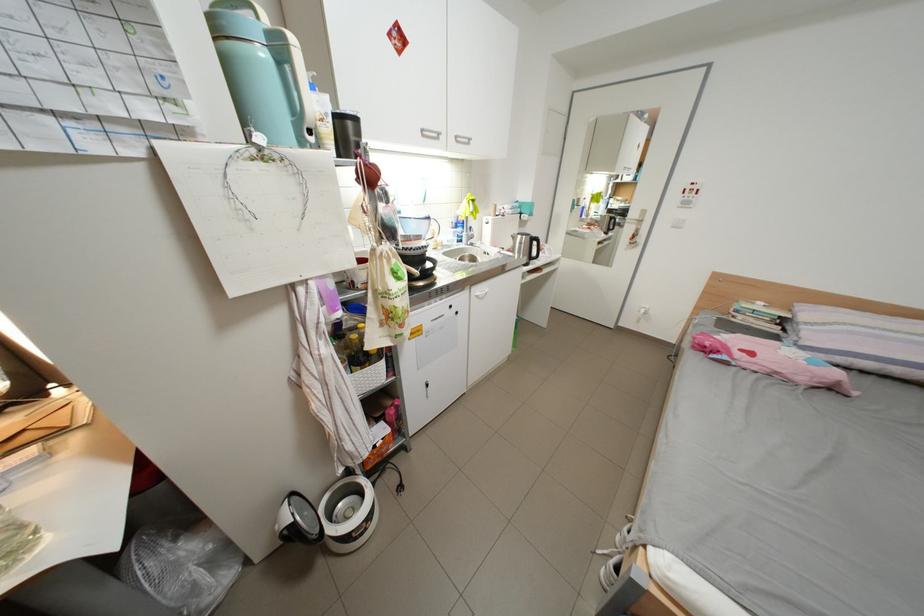
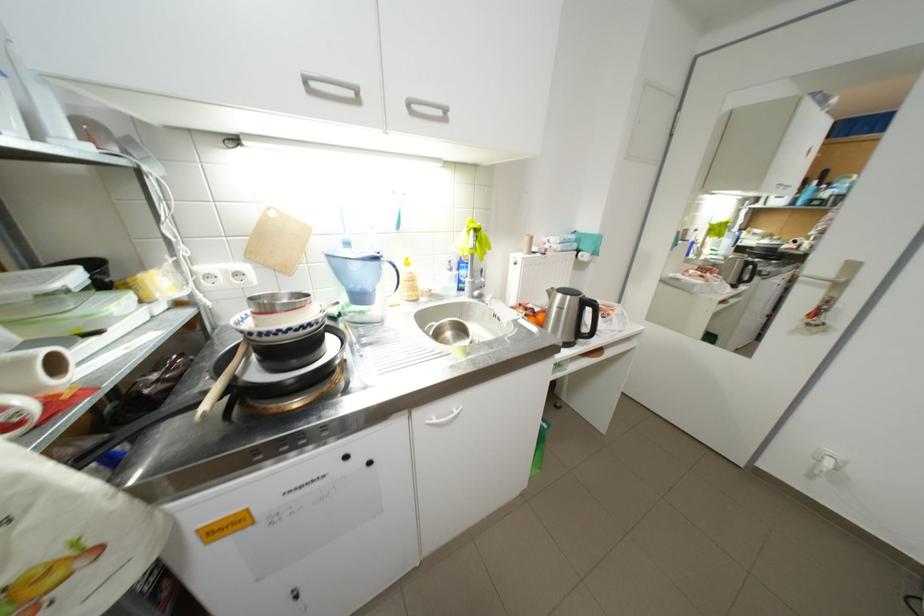
Find the pixel in the second image that matches (434,132) in the first image.

(317, 79)